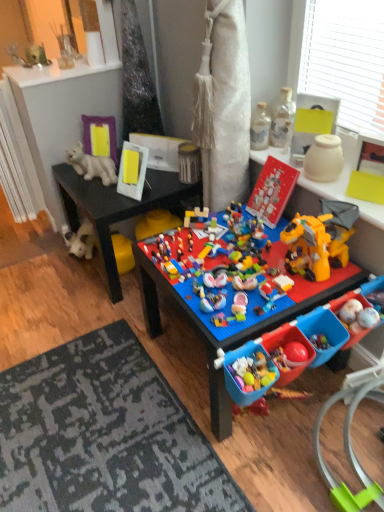
Identify the location of vacant space to the left of white plush dog at lower left, which ranks as the seventh toy in right-to-left order. (57, 263).